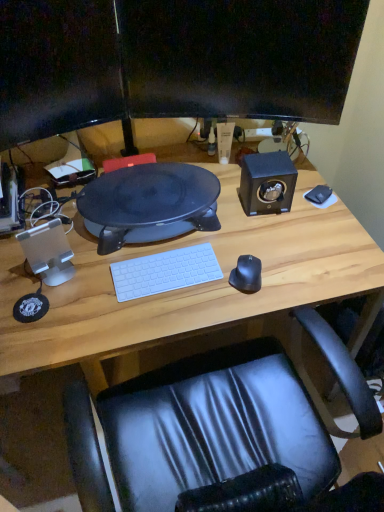
Question: Can you confirm if transparent plastic speaker at left, which is the first speaker from bottom to top, is taller than black matte speaker at upper right, marked as the 1th speaker in a back-to-front arrangement?

Choices:
 (A) yes
 (B) no

Answer: (A)

Question: From a real-world perspective, is transparent plastic speaker at left, which appears as the second speaker when viewed from the top, positioned over black matte speaker at upper right, marked as the second speaker in a front-to-back arrangement, based on gravity?

Choices:
 (A) yes
 (B) no

Answer: (B)

Question: Is transparent plastic speaker at left, which is the first speaker from bottom to top, far away from black matte speaker at upper right, marked as the second speaker in a front-to-back arrangement?

Choices:
 (A) no
 (B) yes

Answer: (A)

Question: Is transparent plastic speaker at left, which is counted as the first speaker, starting from the front, smaller than black matte speaker at upper right, the 1th speaker positioned from the right?

Choices:
 (A) yes
 (B) no

Answer: (A)

Question: Is transparent plastic speaker at left, acting as the 2th speaker starting from the right, positioned in front of black matte speaker at upper right, marked as the second speaker in a front-to-back arrangement?

Choices:
 (A) no
 (B) yes

Answer: (B)

Question: Is point (56, 221) positioned closer to the camera than point (238, 74)?

Choices:
 (A) closer
 (B) farther

Answer: (A)

Question: Considering the positions of transparent plastic speaker at left, which is counted as the first speaker, starting from the front, and black glossy monitor at upper center, the first computer monitor viewed from the right, in the image, is transparent plastic speaker at left, which is counted as the first speaker, starting from the front, taller or shorter than black glossy monitor at upper center, the first computer monitor viewed from the right,?

Choices:
 (A) tall
 (B) short

Answer: (B)

Question: Is transparent plastic speaker at left, the second speaker from the back, wider or thinner than black glossy monitor at upper center, the first computer monitor viewed from the right?

Choices:
 (A) thin
 (B) wide

Answer: (B)

Question: From a real-world perspective, is transparent plastic speaker at left, which is the first speaker from bottom to top, physically located above or below black glossy monitor at upper center, which is the 2th computer monitor from left to right?

Choices:
 (A) below
 (B) above

Answer: (A)

Question: Is black matte speaker at upper right, the 1th speaker positioned from the right, in front of or behind black matte mouse at right in the image?

Choices:
 (A) front
 (B) behind

Answer: (B)

Question: Considering the positions of black matte speaker at upper right, marked as the second speaker in a front-to-back arrangement, and black matte mouse at right in the image, is black matte speaker at upper right, marked as the second speaker in a front-to-back arrangement, wider or thinner than black matte mouse at right?

Choices:
 (A) wide
 (B) thin

Answer: (A)

Question: Does point (284, 196) appear closer or farther from the camera than point (254, 287)?

Choices:
 (A) farther
 (B) closer

Answer: (A)

Question: From a real-world perspective, relative to black matte mouse at right, is black matte speaker at upper right, the 1th speaker when ordered from top to bottom, vertically above or below?

Choices:
 (A) above
 (B) below

Answer: (A)

Question: Relative to transparent plastic speaker at left, which is counted as the first speaker, starting from the front, is black matte mouse at right in front or behind?

Choices:
 (A) front
 (B) behind

Answer: (B)

Question: From the image's perspective, is black matte mouse at right positioned above or below transparent plastic speaker at left, which appears as the second speaker when viewed from the top?

Choices:
 (A) below
 (B) above

Answer: (A)